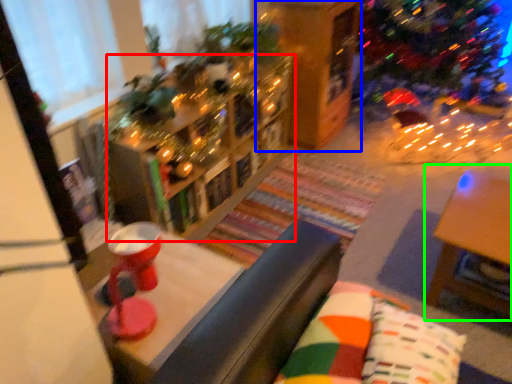
Question: Which object is positioned closest to bookcase (highlighted by a red box)? Select from shelf (highlighted by a blue box) and table (highlighted by a green box).

Choices:
 (A) shelf
 (B) table

Answer: (A)